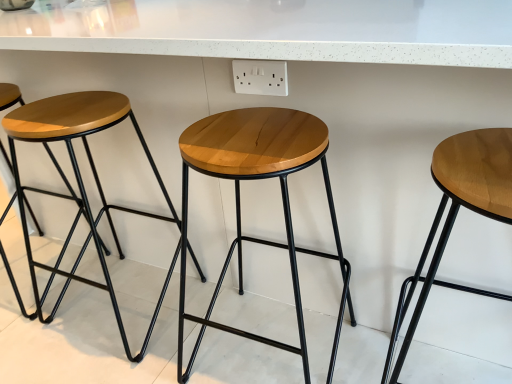
Describe the element at coordinates (458, 210) in the screenshot. I see `light brown wood stool at right, arranged as the 4th stool when viewed from the left` at that location.

Identify the location of wooden stool at left, which is the 2th stool from left to right. (82, 182).

The image size is (512, 384). What do you see at coordinates (240, 206) in the screenshot?
I see `natural wood stool at center, the second stool positioned from the right` at bounding box center [240, 206].

Image resolution: width=512 pixels, height=384 pixels. Identify the location of light brown wood stool at right, arranged as the 4th stool when viewed from the left. (458, 210).

From the image's perspective, who appears lower, natural wood stool at center, the second stool positioned from the right, or wooden stool at left, which is the 2th stool from left to right?

natural wood stool at center, the second stool positioned from the right, is shown below in the image.

From their relative heights in the image, would you say natural wood stool at center, the second stool positioned from the right, is taller or shorter than wooden stool at left, which is the 2th stool from left to right?

In the image, natural wood stool at center, the second stool positioned from the right, appears to be shorter than wooden stool at left, which is the 2th stool from left to right.

Locate an element on the screen. stool that is the 1st object to the right of the wooden stool at left, acting as the third stool starting from the right, starting at the anchor is located at coordinates (240, 206).

Is the position of natural wood stool at center, the second stool positioned from the right, more distant than that of wooden stool at left, acting as the third stool starting from the right?

That is False.

Is matte wood stool at left, the first stool positioned from the left, positioned with its back to wooden stool at left, which is the 2th stool from left to right?

No, matte wood stool at left, the first stool positioned from the left,'s orientation is not away from wooden stool at left, which is the 2th stool from left to right.

Can you confirm if matte wood stool at left, the first stool positioned from the left, is thinner than wooden stool at left, acting as the third stool starting from the right?

No, matte wood stool at left, the first stool positioned from the left, is not thinner than wooden stool at left, acting as the third stool starting from the right.

From a real-world perspective, who is located lower, matte wood stool at left, the first stool positioned from the left, or wooden stool at left, acting as the third stool starting from the right?

In real-world perspective, wooden stool at left, acting as the third stool starting from the right, is lower.

Does matte wood stool at left, the first stool positioned from the left, lie behind wooden stool at left, acting as the third stool starting from the right?

Yes, matte wood stool at left, the first stool positioned from the left, is behind wooden stool at left, acting as the third stool starting from the right.

Does light brown wood stool at right, which is counted as the 1th stool, starting from the right, come behind wooden stool at left, acting as the third stool starting from the right?

No, light brown wood stool at right, which is counted as the 1th stool, starting from the right, is closer to the viewer.

Is light brown wood stool at right, which is counted as the 1th stool, starting from the right, smaller than wooden stool at left, which is the 2th stool from left to right?

Yes, light brown wood stool at right, which is counted as the 1th stool, starting from the right, is smaller than wooden stool at left, which is the 2th stool from left to right.

Considering the positions of objects natural wood stool at center, the 3th stool in the left-to-right sequence, and matte wood stool at left, the first stool positioned from the left, in the image provided, who is more to the left, natural wood stool at center, the 3th stool in the left-to-right sequence, or matte wood stool at left, the first stool positioned from the left,?

matte wood stool at left, the first stool positioned from the left.

Is natural wood stool at center, the second stool positioned from the right, far away from matte wood stool at left, the 4th stool when ordered from right to left?

No.

Which of these two, natural wood stool at center, the second stool positioned from the right, or matte wood stool at left, the 4th stool when ordered from right to left, is smaller?

With smaller size is matte wood stool at left, the 4th stool when ordered from right to left.

Which is nearer, (279, 115) or (31, 318)?

Clearly, point (279, 115) is closer to the camera than point (31, 318).

Which object is closer to the camera, natural wood stool at center, the second stool positioned from the right, or light brown wood stool at right, which is counted as the 1th stool, starting from the right?

light brown wood stool at right, which is counted as the 1th stool, starting from the right.

Which is more to the right, natural wood stool at center, the second stool positioned from the right, or light brown wood stool at right, arranged as the 4th stool when viewed from the left?

From the viewer's perspective, light brown wood stool at right, arranged as the 4th stool when viewed from the left, appears more on the right side.

Is point (242, 134) in front of point (460, 135)?

No, (242, 134) is further to viewer.

Consider the image. From a real-world perspective, is natural wood stool at center, the 3th stool in the left-to-right sequence, located beneath light brown wood stool at right, which is counted as the 1th stool, starting from the right?

Indeed, from a real-world perspective, natural wood stool at center, the 3th stool in the left-to-right sequence, is positioned beneath light brown wood stool at right, which is counted as the 1th stool, starting from the right.

From the image's perspective, which one is positioned lower, light brown wood stool at right, which is counted as the 1th stool, starting from the right, or natural wood stool at center, the 3th stool in the left-to-right sequence?

light brown wood stool at right, which is counted as the 1th stool, starting from the right.

Are light brown wood stool at right, arranged as the 4th stool when viewed from the left, and natural wood stool at center, the 3th stool in the left-to-right sequence, beside each other?

There is a gap between light brown wood stool at right, arranged as the 4th stool when viewed from the left, and natural wood stool at center, the 3th stool in the left-to-right sequence.

How different are the orientations of light brown wood stool at right, arranged as the 4th stool when viewed from the left, and natural wood stool at center, the second stool positioned from the right, in degrees?

The facing directions of light brown wood stool at right, arranged as the 4th stool when viewed from the left, and natural wood stool at center, the second stool positioned from the right, are 0.000294 degrees apart.

Does point (500, 203) come behind point (207, 130)?

No, (500, 203) is in front of (207, 130).

Is light brown wood stool at right, arranged as the 4th stool when viewed from the left, positioned far away from matte wood stool at left, the first stool positioned from the left?

Yes, light brown wood stool at right, arranged as the 4th stool when viewed from the left, is far from matte wood stool at left, the first stool positioned from the left.

The width and height of the screenshot is (512, 384). I want to click on stool that is the 3rd one when counting forward from the matte wood stool at left, the 4th stool when ordered from right to left, so click(x=458, y=210).

Is light brown wood stool at right, arranged as the 4th stool when viewed from the left, closer to camera compared to matte wood stool at left, the 4th stool when ordered from right to left?

Yes, it is in front of matte wood stool at left, the 4th stool when ordered from right to left.

Between light brown wood stool at right, which is counted as the 1th stool, starting from the right, and matte wood stool at left, the first stool positioned from the left, which one has smaller width?

matte wood stool at left, the first stool positioned from the left.

This screenshot has height=384, width=512. There is a natural wood stool at center, the second stool positioned from the right. Find the location of `the 2nd stool above it (from a real-world perspective)`. the 2nd stool above it (from a real-world perspective) is located at coordinates (82, 182).

You are a GUI agent. You are given a task and a screenshot of the screen. Output one action in this format:
    pyautogui.click(x=<x>, y=<y>)
    Task: Click on the 1st stool in front when counting from the matte wood stool at left, the 4th stool when ordered from right to left
    The width and height of the screenshot is (512, 384).
    Given the screenshot: What is the action you would take?
    pyautogui.click(x=82, y=182)

Estimate the real-world distances between objects in this image. Which object is further from natural wood stool at center, the 3th stool in the left-to-right sequence, light brown wood stool at right, which is counted as the 1th stool, starting from the right, or matte wood stool at left, the first stool positioned from the left?

The object further to natural wood stool at center, the 3th stool in the left-to-right sequence, is matte wood stool at left, the first stool positioned from the left.

Based on the photo, based on their spatial positions, is natural wood stool at center, the 3th stool in the left-to-right sequence, or light brown wood stool at right, arranged as the 4th stool when viewed from the left, further from matte wood stool at left, the 4th stool when ordered from right to left?

light brown wood stool at right, arranged as the 4th stool when viewed from the left.

When comparing their distances from natural wood stool at center, the 3th stool in the left-to-right sequence, does matte wood stool at left, the first stool positioned from the left, or light brown wood stool at right, arranged as the 4th stool when viewed from the left, seem further?

Based on the image, matte wood stool at left, the first stool positioned from the left, appears to be further to natural wood stool at center, the 3th stool in the left-to-right sequence.

Looking at the image, which one is located further to wooden stool at left, acting as the third stool starting from the right, natural wood stool at center, the second stool positioned from the right, or light brown wood stool at right, arranged as the 4th stool when viewed from the left?

light brown wood stool at right, arranged as the 4th stool when viewed from the left, is further to wooden stool at left, acting as the third stool starting from the right.

Looking at the image, which one is located further to natural wood stool at center, the 3th stool in the left-to-right sequence, wooden stool at left, acting as the third stool starting from the right, or matte wood stool at left, the first stool positioned from the left?

matte wood stool at left, the first stool positioned from the left, is positioned further to the anchor natural wood stool at center, the 3th stool in the left-to-right sequence.

Looking at the image, which one is located further to light brown wood stool at right, which is counted as the 1th stool, starting from the right, natural wood stool at center, the second stool positioned from the right, or wooden stool at left, acting as the third stool starting from the right?

wooden stool at left, acting as the third stool starting from the right, is further to light brown wood stool at right, which is counted as the 1th stool, starting from the right.

Looking at the image, which one is located closer to light brown wood stool at right, which is counted as the 1th stool, starting from the right, matte wood stool at left, the first stool positioned from the left, or natural wood stool at center, the 3th stool in the left-to-right sequence?

natural wood stool at center, the 3th stool in the left-to-right sequence, is closer to light brown wood stool at right, which is counted as the 1th stool, starting from the right.

From the picture: From the image, which object appears to be farther from light brown wood stool at right, arranged as the 4th stool when viewed from the left, wooden stool at left, acting as the third stool starting from the right, or matte wood stool at left, the first stool positioned from the left?

matte wood stool at left, the first stool positioned from the left, is further to light brown wood stool at right, arranged as the 4th stool when viewed from the left.

This screenshot has width=512, height=384. In order to click on stool between matte wood stool at left, the 4th stool when ordered from right to left, and natural wood stool at center, the second stool positioned from the right, in the horizontal direction in this screenshot , I will do `click(82, 182)`.

Locate an element on the screen. This screenshot has width=512, height=384. stool between wooden stool at left, which is the 2th stool from left to right, and light brown wood stool at right, arranged as the 4th stool when viewed from the left, in the horizontal direction is located at coordinates (240, 206).